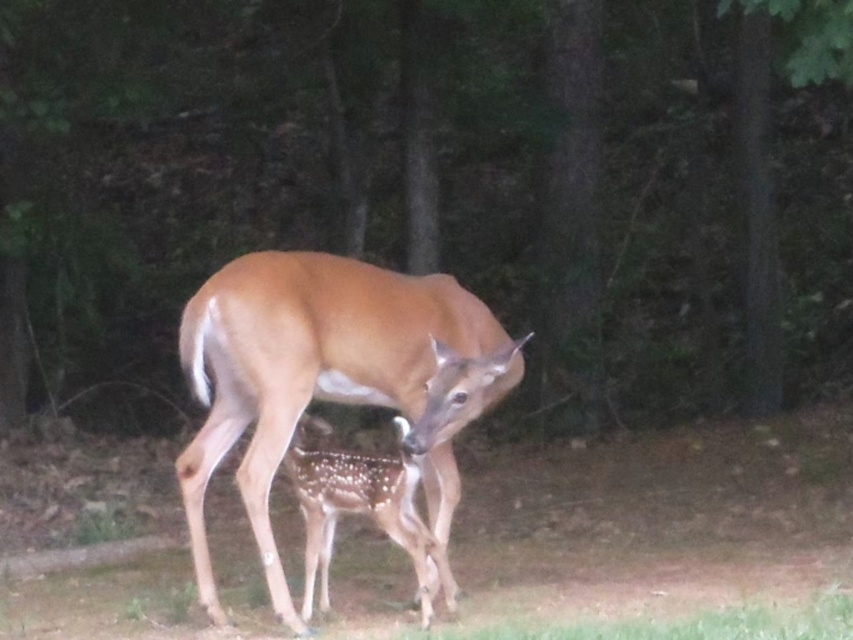
Question: Which point is closer to the camera?

Choices:
 (A) (438, 513)
 (B) (426, 529)

Answer: (B)

Question: Can you confirm if brown velvet deer at center is positioned above spotted fur fawn at center?

Choices:
 (A) yes
 (B) no

Answer: (A)

Question: Is brown velvet deer at center closer to camera compared to spotted fur fawn at center?

Choices:
 (A) yes
 (B) no

Answer: (A)

Question: Which point is closer to the camera?

Choices:
 (A) spotted fur fawn at center
 (B) brown velvet deer at center

Answer: (B)

Question: Is brown velvet deer at center below spotted fur fawn at center?

Choices:
 (A) yes
 (B) no

Answer: (B)